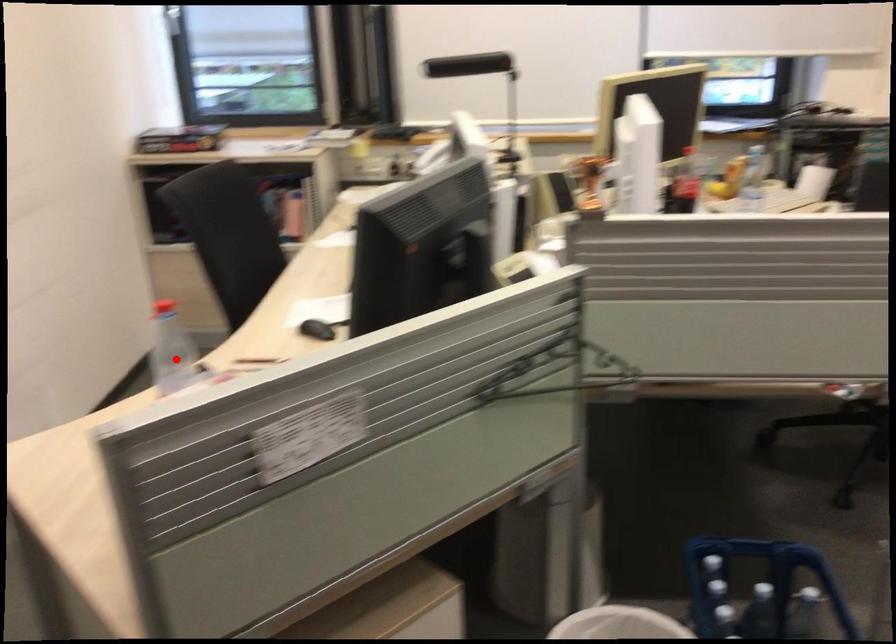
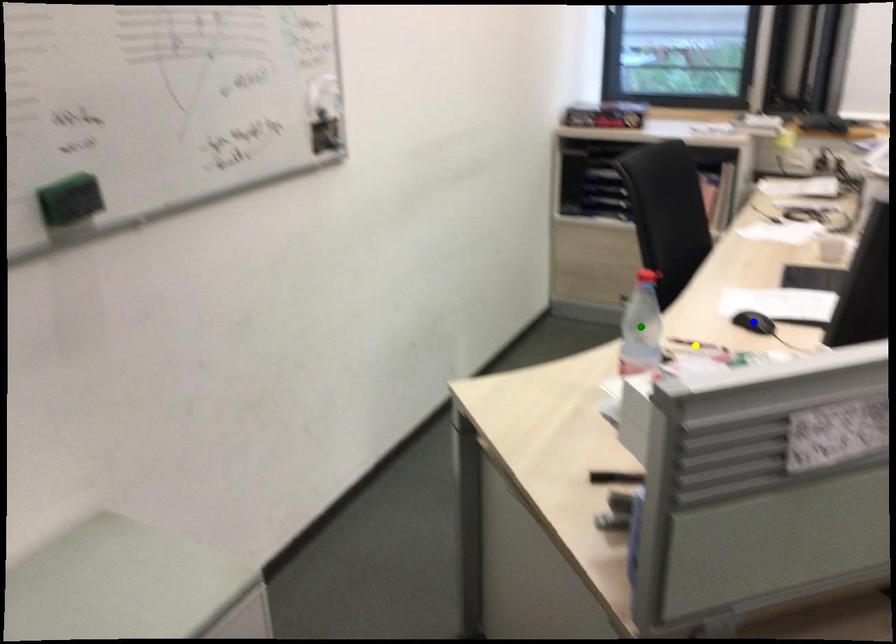
Question: I am providing you with two images of the same scene from different viewpoints. A red point is marked on the first image. You are given multiple points on the second image. Which point in image 2 represents the same 3d spot as the red point in image 1?

Choices:
 (A) blue point
 (B) green point
 (C) yellow point

Answer: (B)